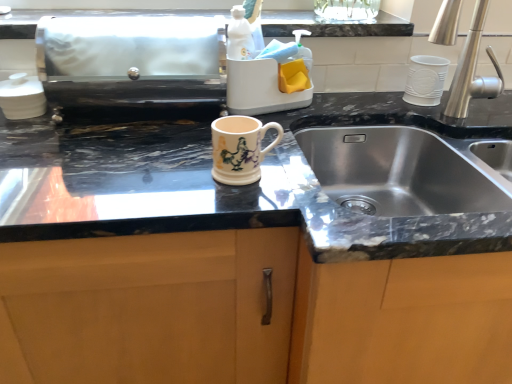
The width and height of the screenshot is (512, 384). What are the coordinates of `free space in front of matte ceramic mug at center` in the screenshot? It's located at (240, 204).